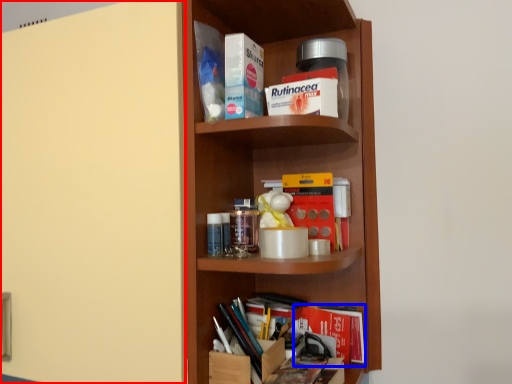
Question: Among these objects, which one is nearest to the camera, door (highlighted by a red box) or book (highlighted by a blue box)?

Choices:
 (A) door
 (B) book

Answer: (A)